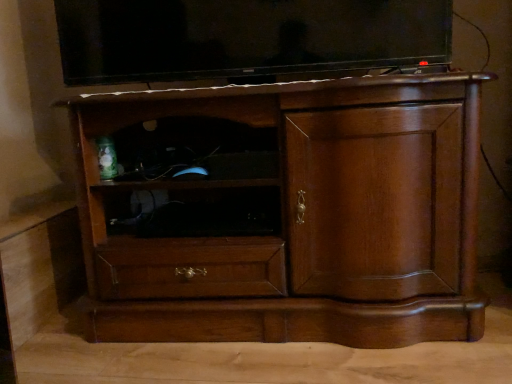
Question: Does brown wood cabinet at center have a larger size compared to matte black tv at upper center?

Choices:
 (A) no
 (B) yes

Answer: (B)

Question: Is brown wood cabinet at center located outside matte black tv at upper center?

Choices:
 (A) no
 (B) yes

Answer: (B)

Question: Does brown wood cabinet at center turn towards matte black tv at upper center?

Choices:
 (A) yes
 (B) no

Answer: (B)

Question: Does brown wood cabinet at center have a lesser width compared to matte black tv at upper center?

Choices:
 (A) yes
 (B) no

Answer: (B)

Question: Is matte black tv at upper center completely or partially inside brown wood cabinet at center?

Choices:
 (A) no
 (B) yes

Answer: (A)

Question: Based on their sizes in the image, would you say matte black tv at upper center is bigger or smaller than brown wood cabinet at center?

Choices:
 (A) big
 (B) small

Answer: (B)

Question: From a real-world perspective, is matte black tv at upper center positioned above or below brown wood cabinet at center?

Choices:
 (A) below
 (B) above

Answer: (B)

Question: Considering the positions of point (92, 41) and point (87, 163), is point (92, 41) closer or farther from the camera than point (87, 163)?

Choices:
 (A) farther
 (B) closer

Answer: (A)

Question: Is matte black tv at upper center inside or outside of brown wood cabinet at center?

Choices:
 (A) inside
 (B) outside

Answer: (B)

Question: In terms of width, does brown wood cabinet at center look wider or thinner when compared to black matte shelf at center?

Choices:
 (A) thin
 (B) wide

Answer: (B)

Question: From the image's perspective, is brown wood cabinet at center above or below black matte shelf at center?

Choices:
 (A) below
 (B) above

Answer: (B)

Question: Would you say brown wood cabinet at center is inside or outside black matte shelf at center?

Choices:
 (A) outside
 (B) inside

Answer: (A)

Question: Would you say brown wood cabinet at center is to the left or to the right of black matte shelf at center in the picture?

Choices:
 (A) left
 (B) right

Answer: (B)

Question: Looking at the image, does brown wood cabinet at center seem bigger or smaller compared to matte black tv at upper center?

Choices:
 (A) small
 (B) big

Answer: (B)

Question: From the image's perspective, is brown wood cabinet at center located above or below matte black tv at upper center?

Choices:
 (A) above
 (B) below

Answer: (B)